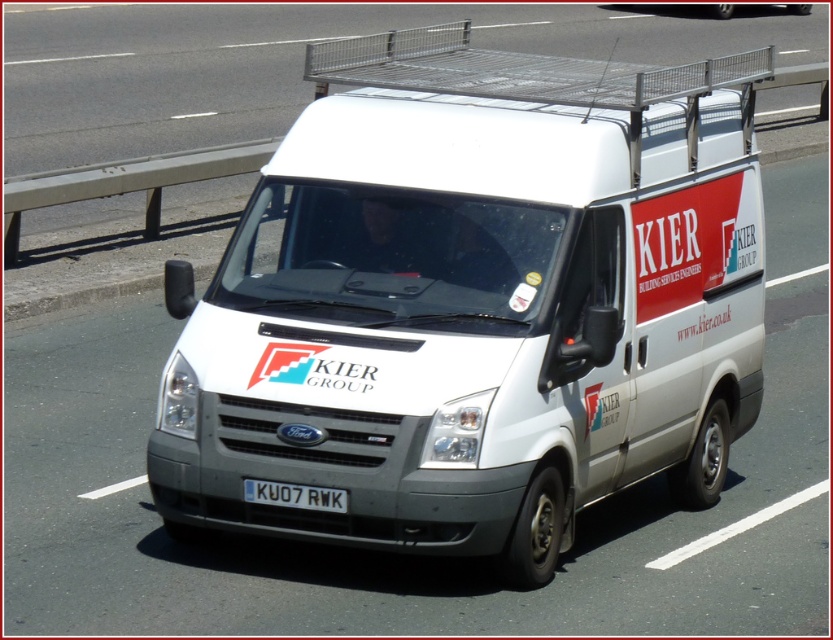
You are a traffic officer observing a road scene. You notice a white van at center and a white plastic license plate at center. Which object is closer to you?

The white van at center is closer to you because the white plastic license plate at center is behind it.

You are a delivery driver who needs to attach a GPS tracker to the white plastic license plate at center of the white matte van at center. The GPS tracker requires a minimum of 6 feet of space between it and any other object to function properly. Based on the scene description, will the GPS tracker work correctly when attached to the license plate?

The distance between the white matte van at center and the white plastic license plate at center is 5.89 feet. Since the GPS tracker requires a minimum of 6 feet of space to function properly, the tracker will not work correctly when attached to the license plate because the distance is less than required.